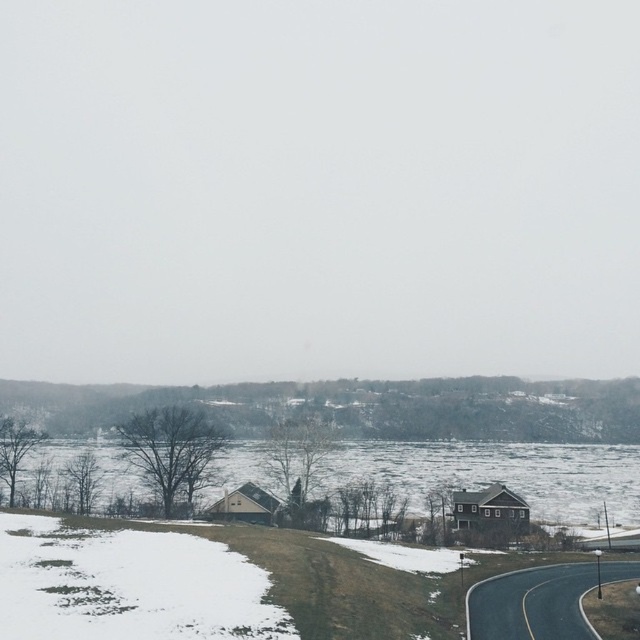
You are standing at the white powdery snow at lower left and want to walk to the snowy grassy hill at center. Which direction should you head?

You should head to the right to reach the snowy grassy hill at center from the white powdery snow at lower left since it is located to the right of it.

Please write a question based on the given information without revealing the coordinates of the snowy grassy hill at center. Use the scene description to frame the question and ensure the object label appears exactly as provided.

The snowy grassy hill at center is located at coordinates point (364, 406).

You are planning to build a small garden between the brown wooden house at center and the snowy grassy hill at center. Which object is wider so that the garden can be placed next to it to maximize space?

The brown wooden house at center is wider than the snowy grassy hill at center, so placing the garden next to the brown wooden house at center would allow for more space.